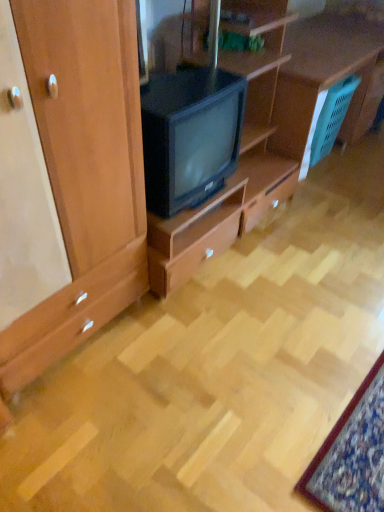
Question: Should I look upward or downward to see teal plastic picnic basket at right?

Choices:
 (A) down
 (B) up

Answer: (B)